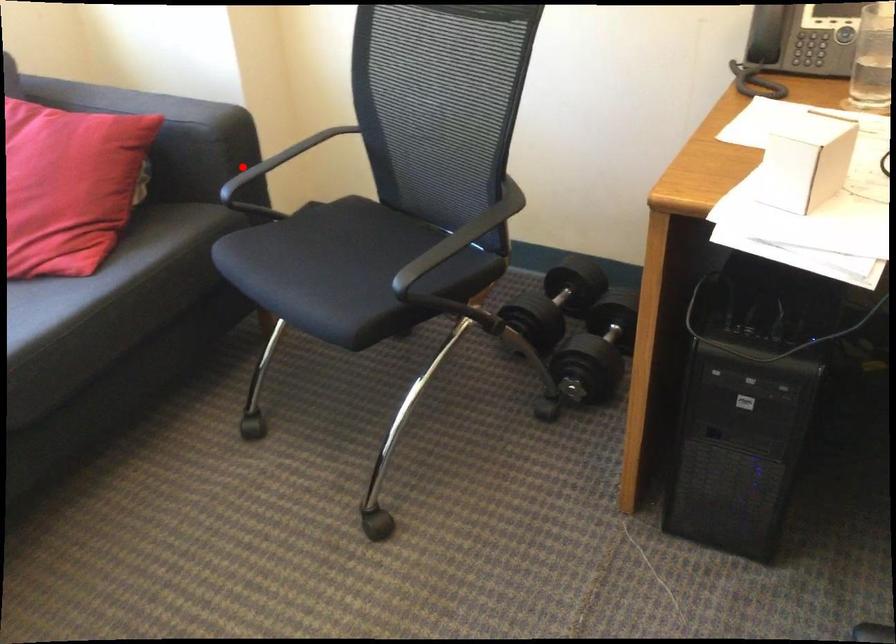
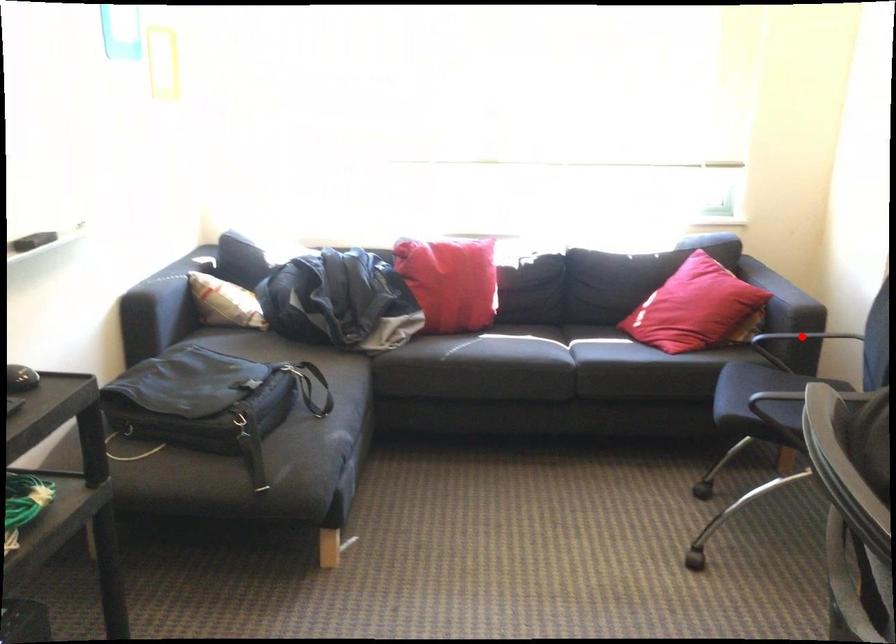
I am providing you with two images of the same scene from different viewpoints. A red point is marked on the first image and another point is marked on the second image. Is the red point in image1 aligned with the point shown in image2?

Yes